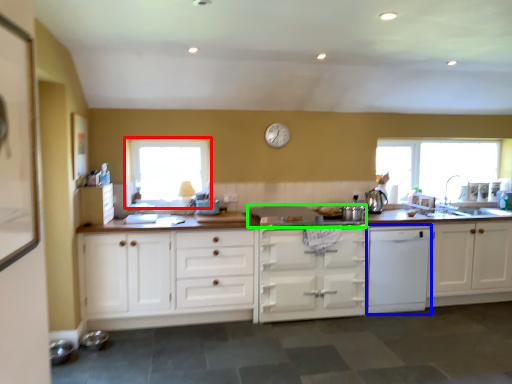
Question: Which object is positioned closest to window (highlighted by a red box)? Select from kitchen appliance (highlighted by a blue box) and gas stove (highlighted by a green box).

Choices:
 (A) kitchen appliance
 (B) gas stove

Answer: (B)